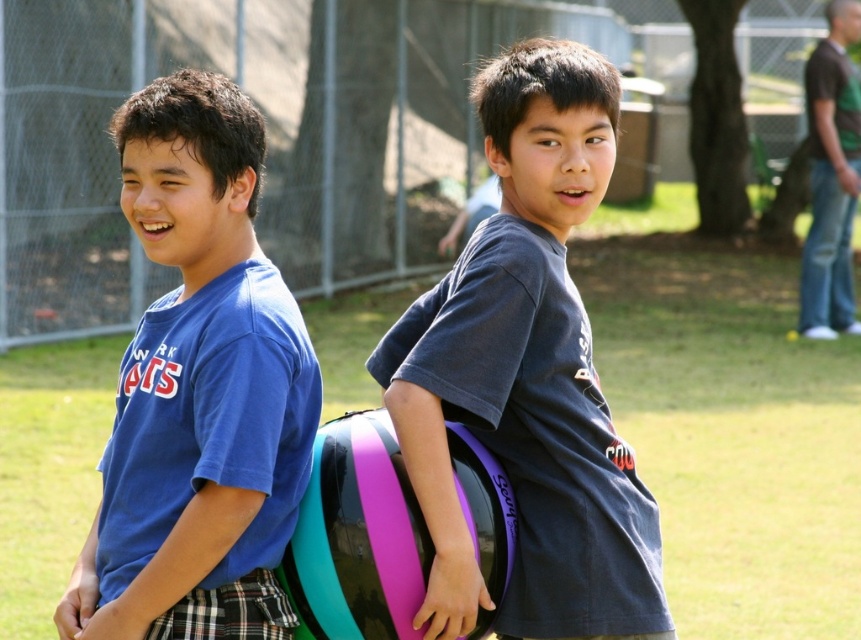
You are a photographer trying to capture a photo of the purple glossy frisbee at center and the blue matte shirt at left. From the perspective of the photographer standing behind the boys, which object is positioned higher in the frame?

The purple glossy frisbee at center is located above the blue matte shirt at left, so it is positioned higher in the frame.

You are a drone operator trying to capture a photo of both the purple glossy frisbee at center and the blue matte shirt at left in the same frame. The minimum distance between the objects for the camera to focus properly is 24 inches. Will you be able to capture both in focus?

The purple glossy frisbee at center and blue matte shirt at left are 22.59 inches apart from each other, which is less than the required 24 inches. Therefore, the drone operator might struggle to capture both in focus as they are too close.

You are trying to decide whether to throw the purple glossy frisbee at center to the left side where the blue matte shirt at left is located. Considering their sizes, will the frisbee cover the shirt completely when it lands?

The purple glossy frisbee at center has a larger width than the blue matte shirt at left, so when thrown, it could potentially cover the shirt completely depending on the landing position.